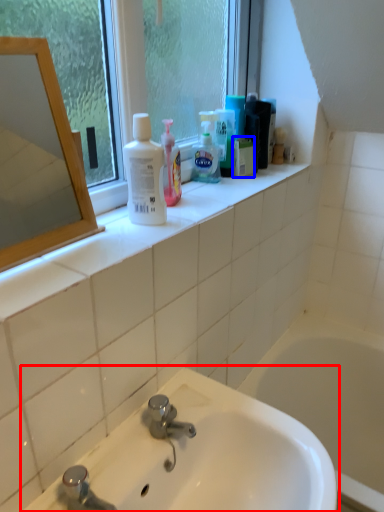
Question: Which object is further to the camera taking this photo, sink (highlighted by a red box) or mouthwash (highlighted by a blue box)?

Choices:
 (A) sink
 (B) mouthwash

Answer: (B)